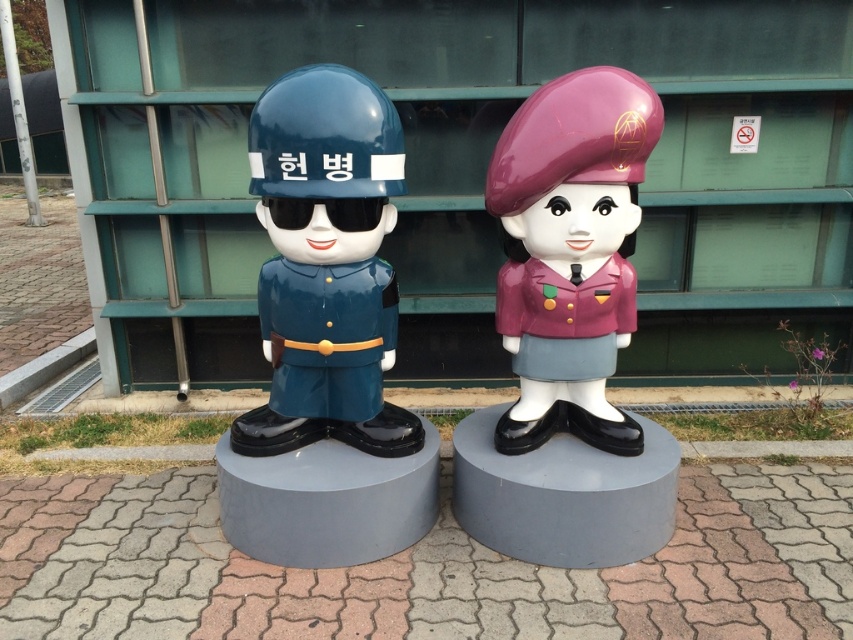
You are standing at the entrance of the modern building and want to take a photo of both statues. The first statue is at point (364, 120) and the second is at point (521, 280). Which statue should you position closer to the camera to ensure both are fully visible in the frame?

Point (364, 120) is in front of point (521, 280), so you should position the statue at point (364, 120) closer to the camera to ensure both are fully visible in the frame.

You are an art curator planning to display a new sculpture collection. You have two items to place on a shelf that can only accommodate items up to 10 inches in width. Given the glossy blue helmet at center and the purple glossy beret at center, which one might not fit if their widths are as described?

The glossy blue helmet at center might not fit on the shelf because its width is larger than that of the purple glossy beret at center, and the shelf has a 10 inches width limit. However, without knowing the exact width measurements, we can only infer based on the given comparison.